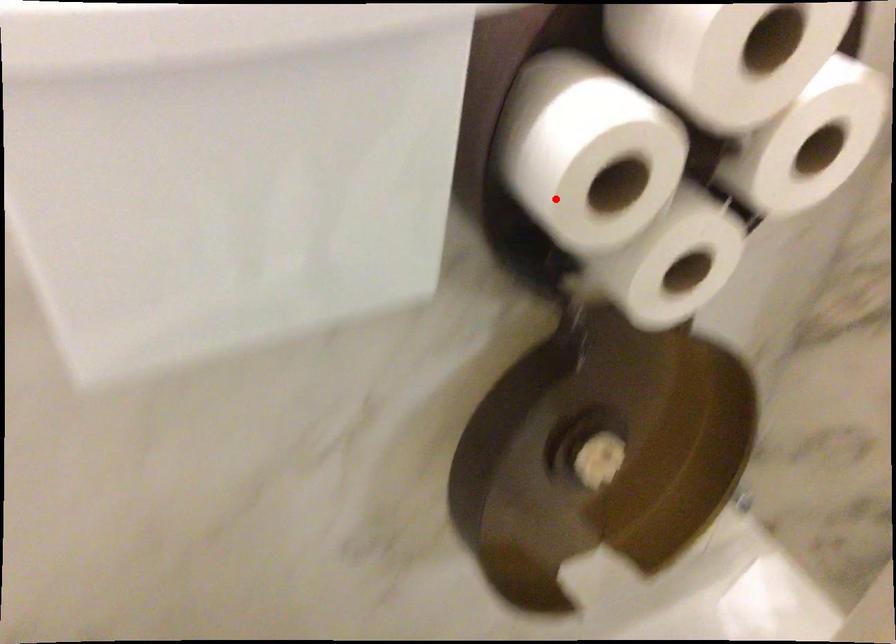
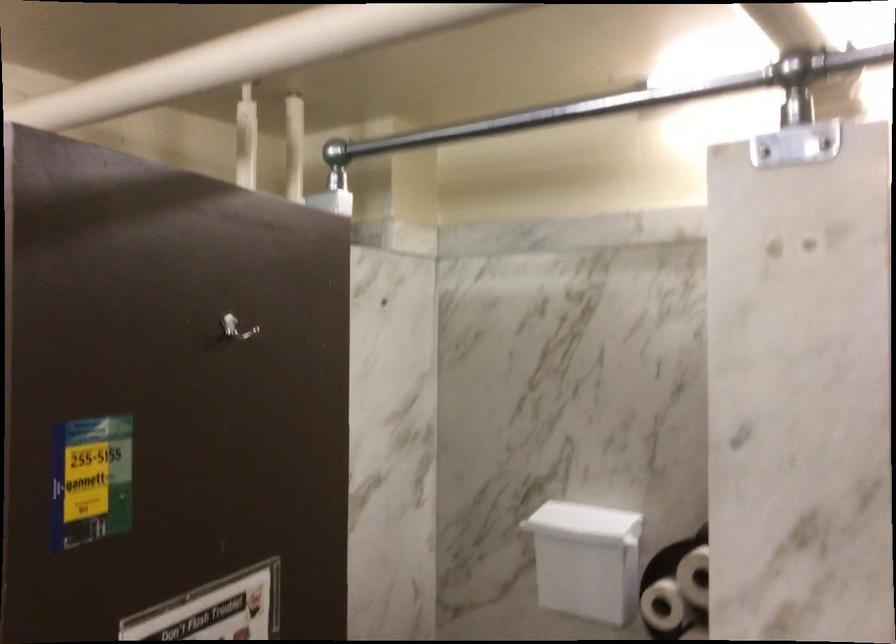
Question: I am providing you with two images of the same scene from different viewpoints. In image1, a red point is highlighted. Considering the same 3D point in image2, which of the following is correct?

Choices:
 (A) It is closer
 (B) It is farther

Answer: (B)